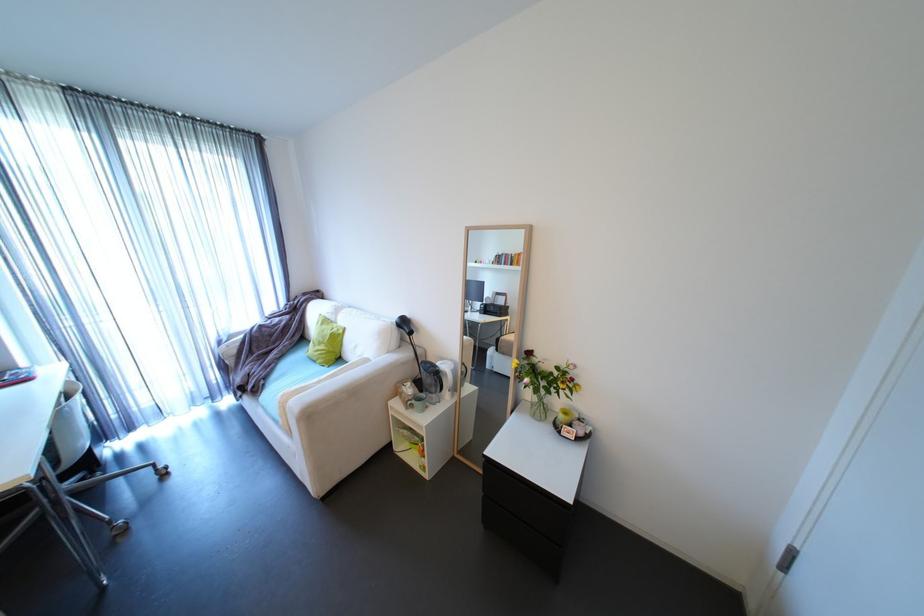
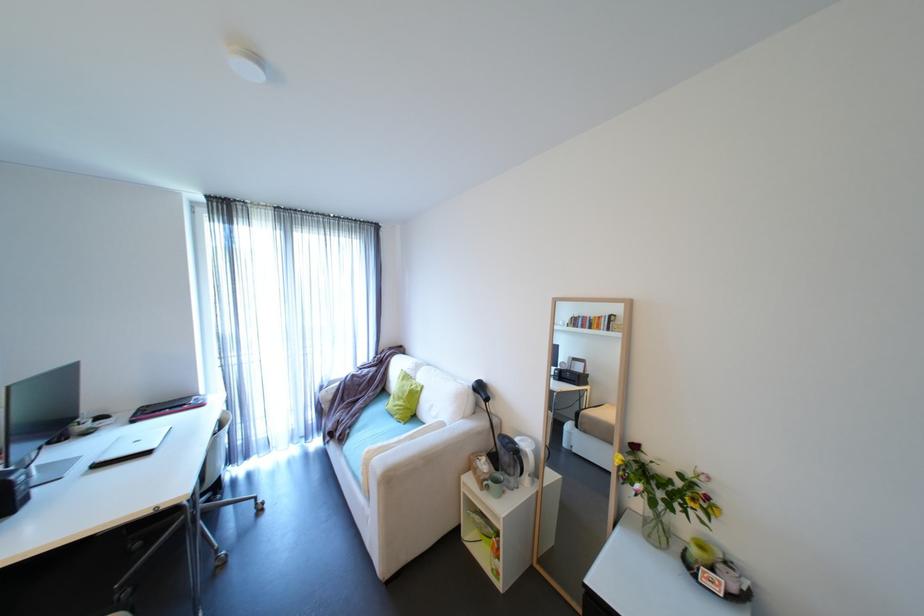
Locate, in the second image, the point that corresponds to [575,373] in the first image.

(703, 485)